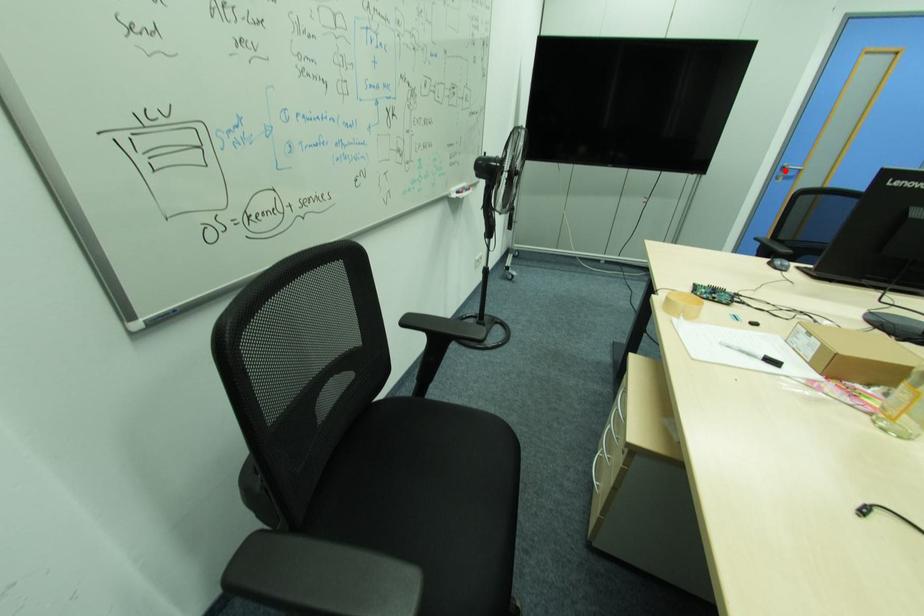
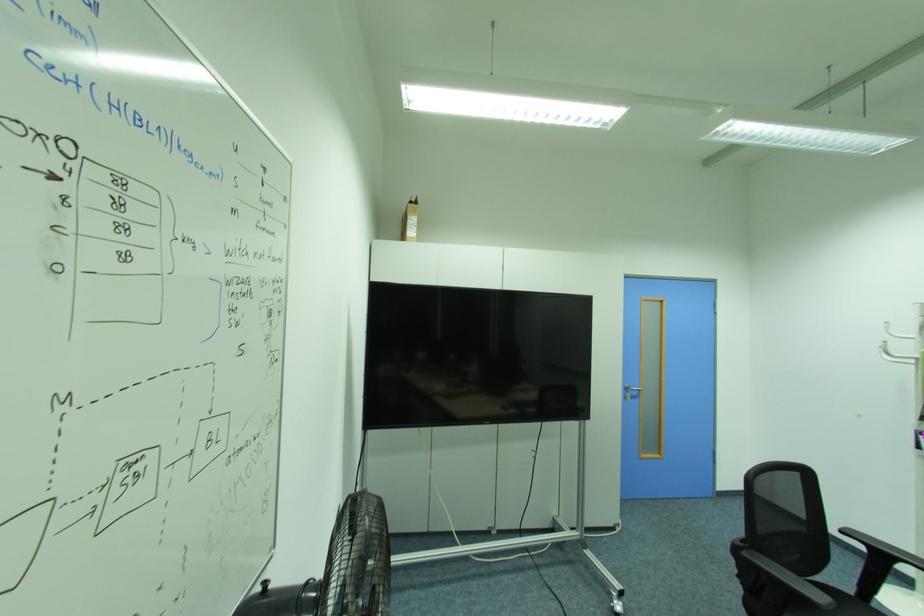
Question: I am providing you with two images of the same scene from different viewpoints. In image1, a red point is highlighted. Considering the same 3D point in image2, which of the following is correct?

Choices:
 (A) It is closer
 (B) It is farther

Answer: (B)